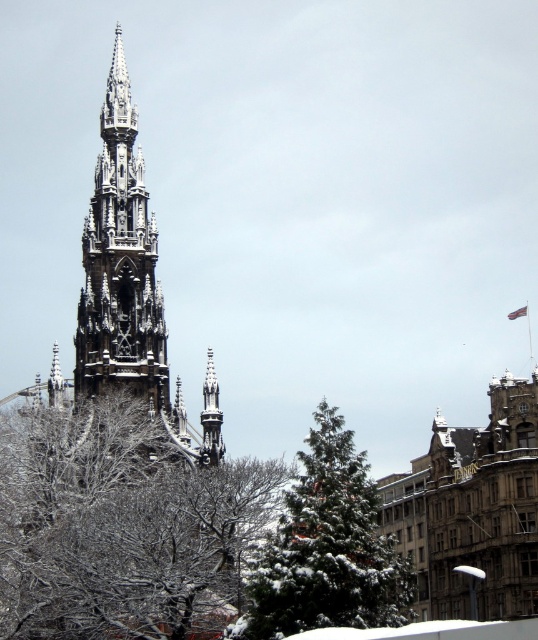
You are standing in front of the Gothic tower and notice a point marked at coordinates (x=121, y=525). Based on the scene description, what object or feature does this point most likely correspond to?

The point at coordinates (x=121, y=525) corresponds to the snow covered branches at center.

You are standing in the winter scene and want to take a photo of the dark gray stone spire at center without the green textured tree at center blocking it. What should you do?

Move to a position where the green textured tree at center is no longer between you and the dark gray stone spire at center since the green textured tree at center is currently in front of the dark gray stone spire at center.